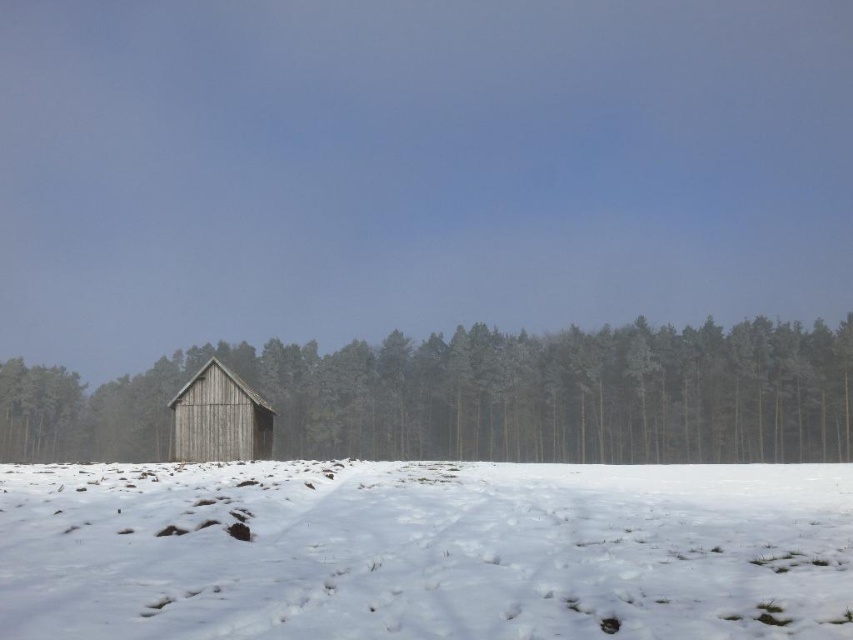
You are an architect designing a new winter landscape scene and want to place both the weathered wood shed at center and the weathered wood barn at center. Based on their sizes, which one should be placed closer to the foreground to maintain proper perspective?

The weathered wood shed at center is larger in size compared to the weathered wood barn at center. To maintain proper perspective, the larger shed should be placed closer to the foreground while the smaller barn is positioned further back.

You are an architect designing a new structure and want to ensure it doesn not block the view of the taller building. Which of the two structures, the weathered wood shed at center or the weathered wood barn at center, should you avoid placing a new structure in front of to preserve the view?

The weathered wood shed at center is taller than the weathered wood barn at center. To preserve the view of the taller structure, avoid placing a new structure in front of the weathered wood shed at center.

You are an architect designing a new winter garden. You want to place a decorative snow sculpture in the area where the white fluffy snow at center and the weathered wood barn at center are located. Based on the scene, which object is on top of the other? Please choose between the two objects.

The white fluffy snow at center is positioned over the weathered wood barn at center, so the snow is on top of the barn.